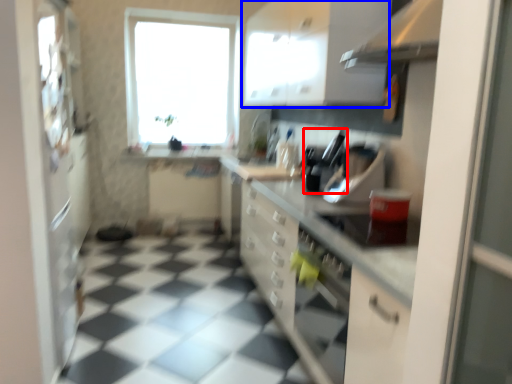
Question: Which object is closer to the camera taking this photo, appliance (highlighted by a red box) or cabinetry (highlighted by a blue box)?

Choices:
 (A) appliance
 (B) cabinetry

Answer: (B)